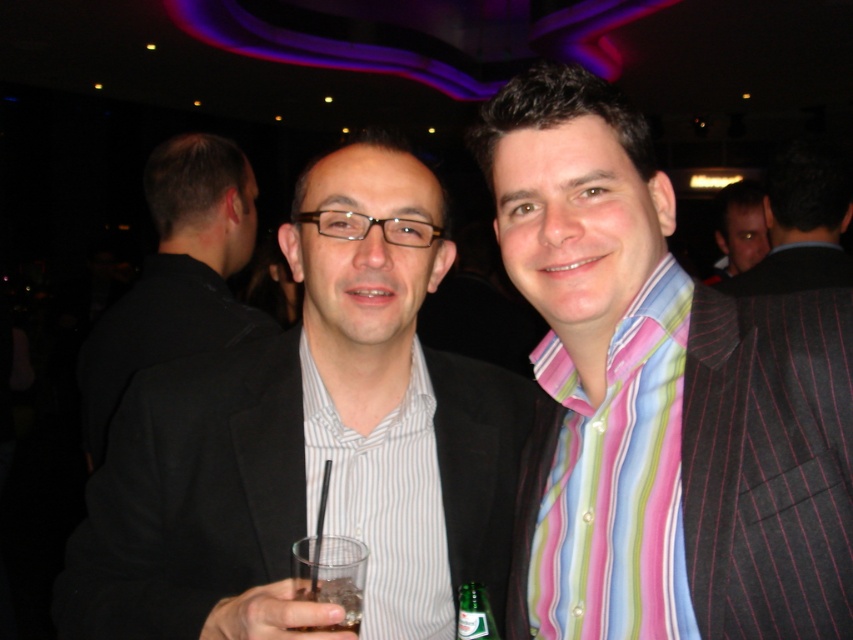
Question: Which point is farther to the camera?

Choices:
 (A) green glass bottle at center
 (B) striped cotton shirt at center
 (C) black smooth suit at left

Answer: (C)

Question: Does matte black suit at center have a larger size compared to black smooth suit at left?

Choices:
 (A) yes
 (B) no

Answer: (B)

Question: Does black smooth suit at left have a larger size compared to green glass bottle at center?

Choices:
 (A) no
 (B) yes

Answer: (B)

Question: Which point appears farthest from the camera in this image?

Choices:
 (A) (132, 433)
 (B) (303, 563)
 (C) (480, 621)

Answer: (A)

Question: Which point appears farthest from the camera in this image?

Choices:
 (A) (466, 595)
 (B) (660, 339)

Answer: (A)

Question: Can you confirm if black smooth suit at left is positioned above dark brown hair at upper right?

Choices:
 (A) no
 (B) yes

Answer: (A)